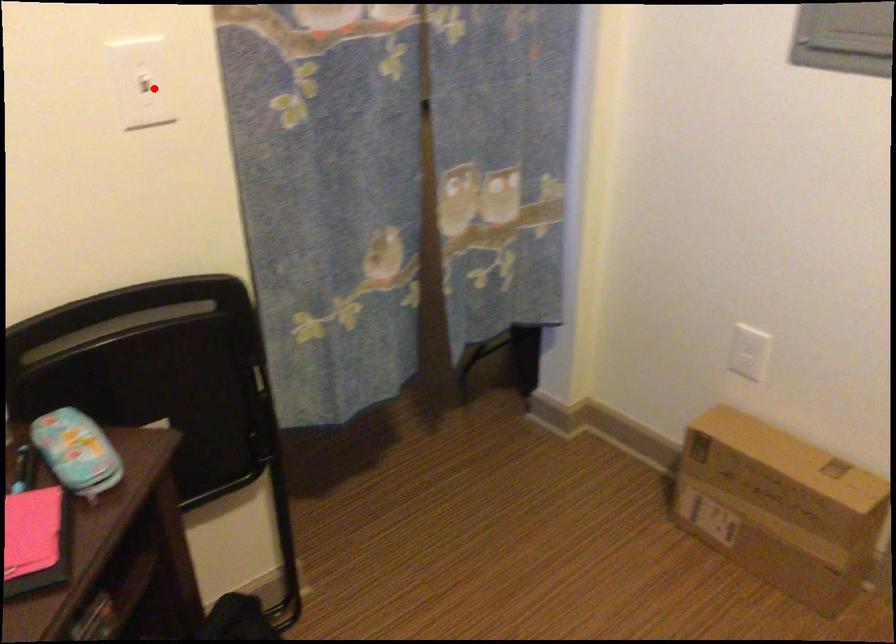
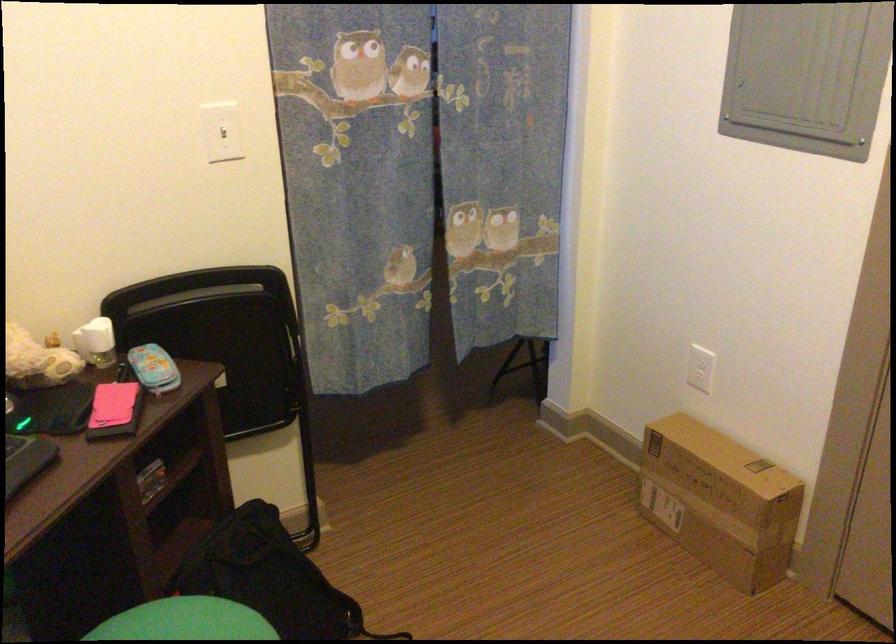
Question: I am providing you with two images of the same scene from different viewpoints. Given a red point in image1, look at the same physical point in image2. Is it:

Choices:
 (A) Closer to the viewpoint
 (B) Farther from the viewpoint

Answer: (B)